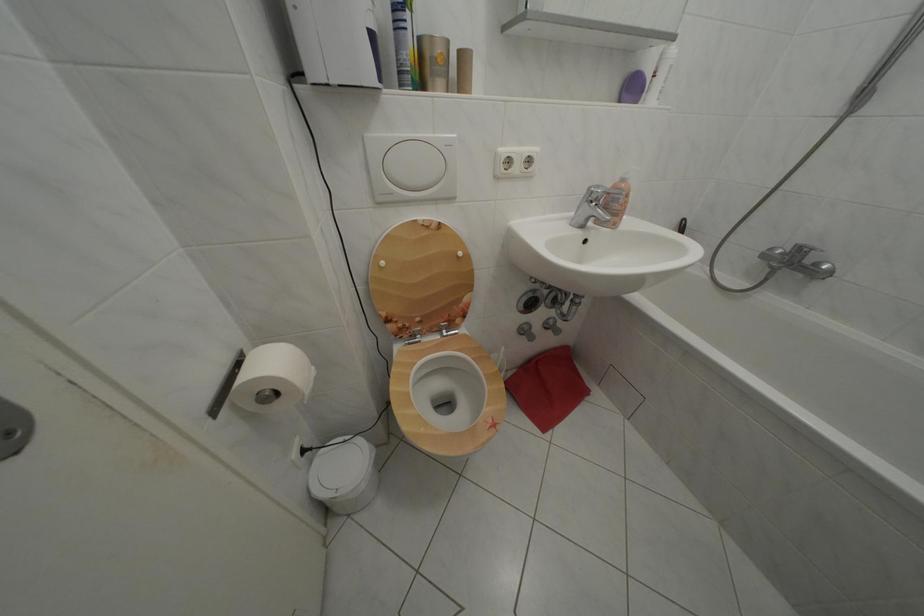
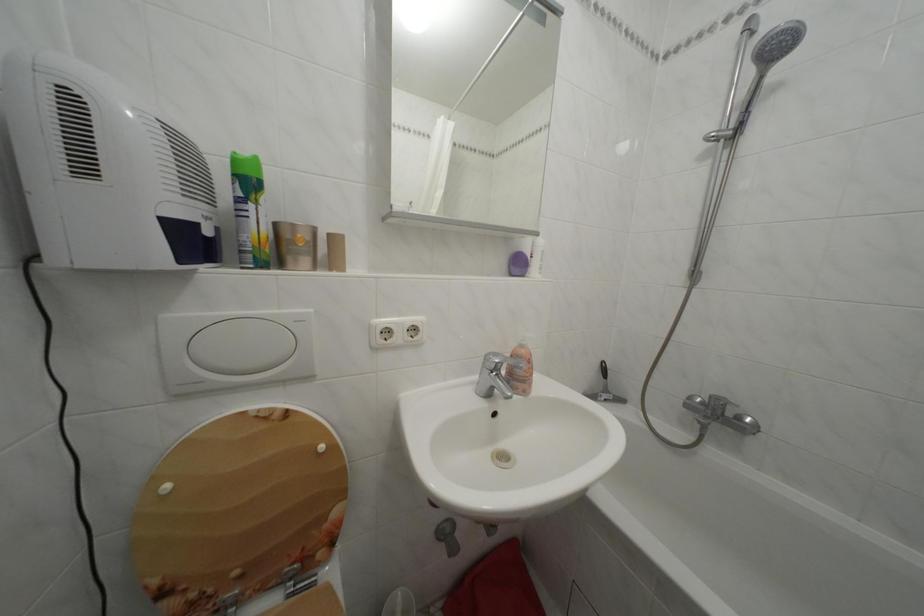
Where in the second image is the point corresponding to (x=375, y=142) from the first image?

(174, 323)